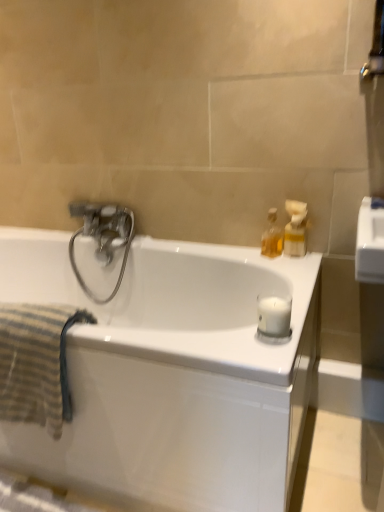
What are the coordinates of `vacant area that lies in front of translucent glass bottle at upper right, which is counted as the 2th soap dispenser, starting from the right` in the screenshot? It's located at (285, 268).